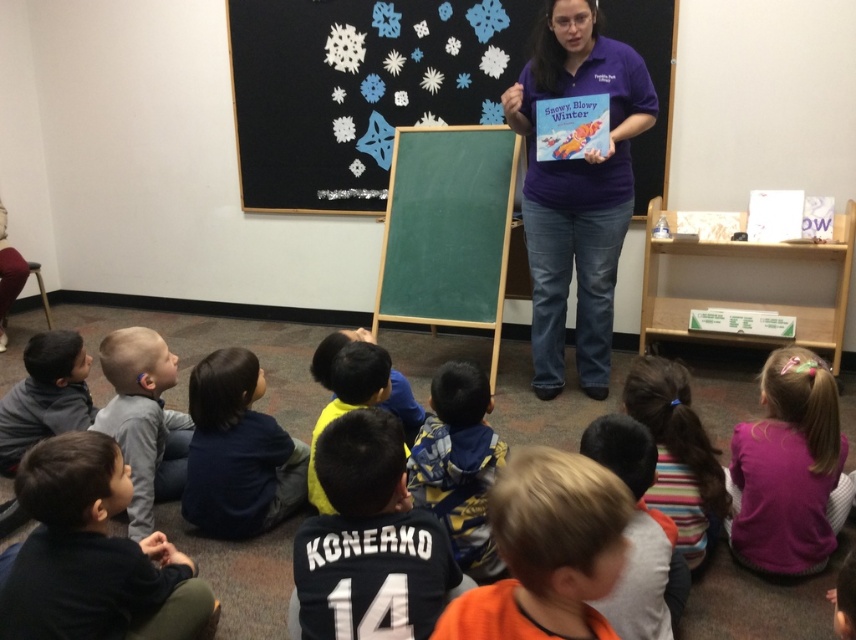
Is purple striped shirt at lower right above dark blue jersey at center?

No, purple striped shirt at lower right is not above dark blue jersey at center.

Between point (704, 492) and point (406, 454), which one is positioned behind?

The point (704, 492) is more distant.

Locate an element on the screen. Image resolution: width=856 pixels, height=640 pixels. purple striped shirt at lower right is located at coordinates (678, 454).

Who is lower down, dark blue sweater at lower left or dark blue shirt at lower center?

Positioned lower is dark blue sweater at lower left.

How far apart are dark blue sweater at lower left and dark blue shirt at lower center?

A distance of 20.34 inches exists between dark blue sweater at lower left and dark blue shirt at lower center.

Where is `dark blue sweater at lower left`? The image size is (856, 640). dark blue sweater at lower left is located at coordinates (94, 556).

Find the location of a particular element. The image size is (856, 640). dark blue sweater at lower left is located at coordinates (94, 556).

Looking at this image, can you confirm if white jersey at center is shorter than orange fabric shirt at lower center?

No, white jersey at center is not shorter than orange fabric shirt at lower center.

Is white jersey at center wider than orange fabric shirt at lower center?

Indeed, white jersey at center has a greater width compared to orange fabric shirt at lower center.

I want to click on white jersey at center, so click(370, 541).

At what (x,y) coordinates should I click in order to perform the action: click on white jersey at center. Please return your answer as a coordinate pair (x, y). Image resolution: width=856 pixels, height=640 pixels. Looking at the image, I should click on (370, 541).